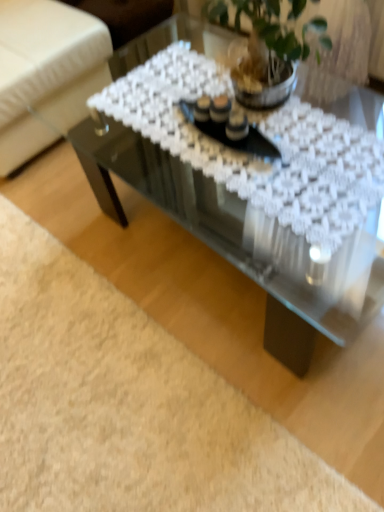
The height and width of the screenshot is (512, 384). Identify the location of white fabric armchair at upper left. (46, 74).

The width and height of the screenshot is (384, 512). Describe the element at coordinates (233, 140) in the screenshot. I see `clear glass plate at center` at that location.

Measure the distance between clear glass plate at center and camera.

They are 1.13 meters apart.

You are a GUI agent. You are given a task and a screenshot of the screen. Output one action in this format:
    pyautogui.click(x=<x>, y=<y>)
    Task: Click on the white fabric armchair at upper left
    This screenshot has width=384, height=512.
    Given the screenshot: What is the action you would take?
    pyautogui.click(x=46, y=74)

Does transparent glass coffee table at center lie behind clear glass plate at center?

No, transparent glass coffee table at center is closer to the camera.

Could you tell me if transparent glass coffee table at center is turned towards clear glass plate at center?

No, transparent glass coffee table at center is not turned towards clear glass plate at center.

Which is farther, (200, 210) or (218, 126)?

The point (200, 210) is more distant.

Find the location of `armchair that is under the clear glass plate at center (from a real-world perspective)`. armchair that is under the clear glass plate at center (from a real-world perspective) is located at coordinates (46, 74).

Is white fabric armchair at upper left inside or outside of clear glass plate at center?

white fabric armchair at upper left cannot be found inside clear glass plate at center.

Does point (110, 55) appear closer or farther from the camera than point (189, 115)?

Clearly, point (110, 55) is more distant from the camera than point (189, 115).

Considering the positions of objects clear glass plate at center and transparent glass coffee table at center in the image provided, who is more to the right, clear glass plate at center or transparent glass coffee table at center?

transparent glass coffee table at center is more to the right.

Is clear glass plate at center aimed at transparent glass coffee table at center?

No, clear glass plate at center does not turn towards transparent glass coffee table at center.

Is clear glass plate at center closer to the viewer compared to transparent glass coffee table at center?

No, clear glass plate at center is behind transparent glass coffee table at center.

Is there a large distance between clear glass plate at center and white fabric armchair at upper left?

clear glass plate at center is actually quite close to white fabric armchair at upper left.

Considering the sizes of objects clear glass plate at center and white fabric armchair at upper left in the image provided, who is wider, clear glass plate at center or white fabric armchair at upper left?

white fabric armchair at upper left.

Based on the photo, does clear glass plate at center appear on the left side of white fabric armchair at upper left?

No.

From the image's perspective, would you say clear glass plate at center is shown under white fabric armchair at upper left?

Yes, from the image's perspective, clear glass plate at center is below white fabric armchair at upper left.

Does white fabric armchair at upper left appear on the left side of transparent glass coffee table at center?

Yes.

From a real-world perspective, between white fabric armchair at upper left and transparent glass coffee table at center, who is vertically lower?

transparent glass coffee table at center.

Looking at this image, which is less distant, (23,130) or (302,345)?

The point (302,345) is in front.

In the scene shown: Considering the sizes of objects white fabric armchair at upper left and transparent glass coffee table at center in the image provided, who is wider, white fabric armchair at upper left or transparent glass coffee table at center?

With larger width is white fabric armchair at upper left.

From a real-world perspective, is transparent glass coffee table at center under white fabric armchair at upper left?

Correct, in the physical world, transparent glass coffee table at center is lower than white fabric armchair at upper left.

Which is more distant, (340, 81) or (6, 25)?

Point (6, 25)

Are transparent glass coffee table at center and white fabric armchair at upper left located far from each other?

No, there isn't a large distance between transparent glass coffee table at center and white fabric armchair at upper left.

I want to click on glass plate behind the transparent glass coffee table at center, so click(x=233, y=140).

This screenshot has width=384, height=512. Identify the location of glass plate above the white fabric armchair at upper left (from a real-world perspective). (233, 140).

Looking at the image, which one is located further to transparent glass coffee table at center, white fabric armchair at upper left or clear glass plate at center?

The object further to transparent glass coffee table at center is white fabric armchair at upper left.

When comparing their distances from clear glass plate at center, does white fabric armchair at upper left or transparent glass coffee table at center seem closer?

Based on the image, transparent glass coffee table at center appears to be nearer to clear glass plate at center.

Which object lies nearer to the anchor point white fabric armchair at upper left, transparent glass coffee table at center or clear glass plate at center?

transparent glass coffee table at center.

Looking at this image, considering their positions, is clear glass plate at center positioned closer to transparent glass coffee table at center than white fabric armchair at upper left?

clear glass plate at center is closer to transparent glass coffee table at center.

When comparing their distances from clear glass plate at center, does transparent glass coffee table at center or white fabric armchair at upper left seem closer?

transparent glass coffee table at center.

Which object lies further to the anchor point white fabric armchair at upper left, clear glass plate at center or transparent glass coffee table at center?

clear glass plate at center is further to white fabric armchair at upper left.

Where is `glass plate located between white fabric armchair at upper left and transparent glass coffee table at center in the left-right direction`? glass plate located between white fabric armchair at upper left and transparent glass coffee table at center in the left-right direction is located at coordinates (233, 140).